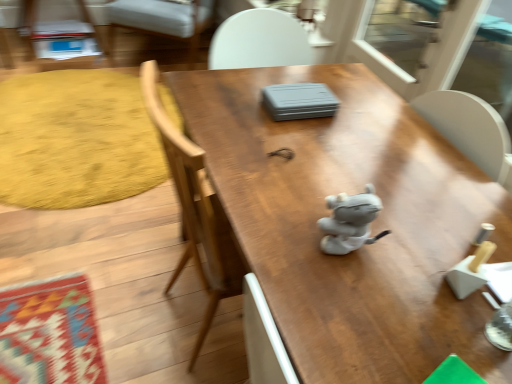
The height and width of the screenshot is (384, 512). In order to click on blank space to the left of gray fabric toy at center in this screenshot , I will do `click(277, 219)`.